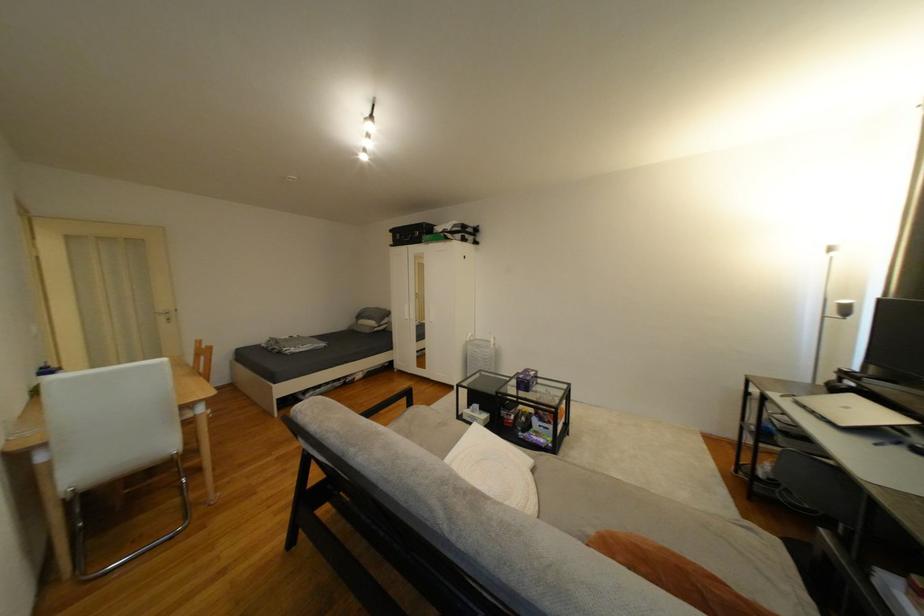
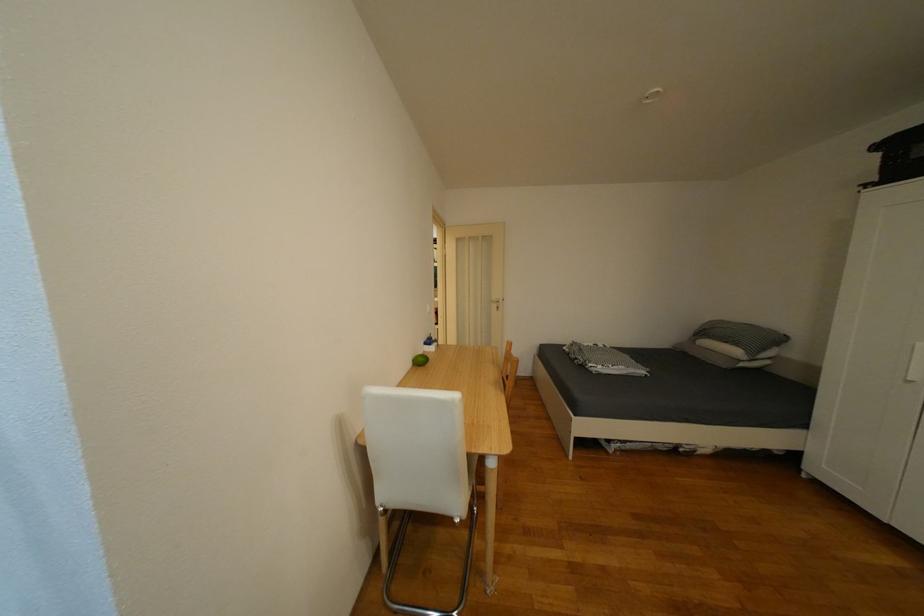
Where in the second image is the point corresponding to the point at 309,347 from the first image?

(618, 368)